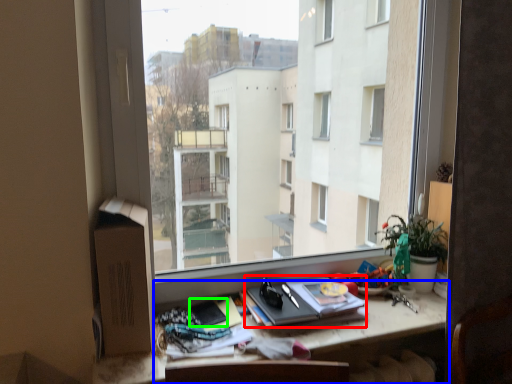
Question: Considering the real-world distances, which object is farthest from paperback book (highlighted by a red box)? desk (highlighted by a blue box) or paperback book (highlighted by a green box)?

Choices:
 (A) desk
 (B) paperback book

Answer: (B)